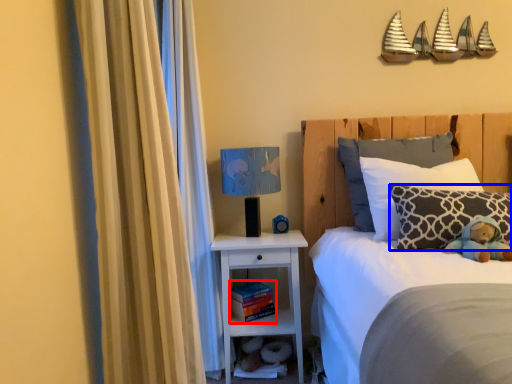
Question: Which of the following is the farthest to the observer, book (highlighted by a red box) or pillow (highlighted by a blue box)?

Choices:
 (A) book
 (B) pillow

Answer: (A)